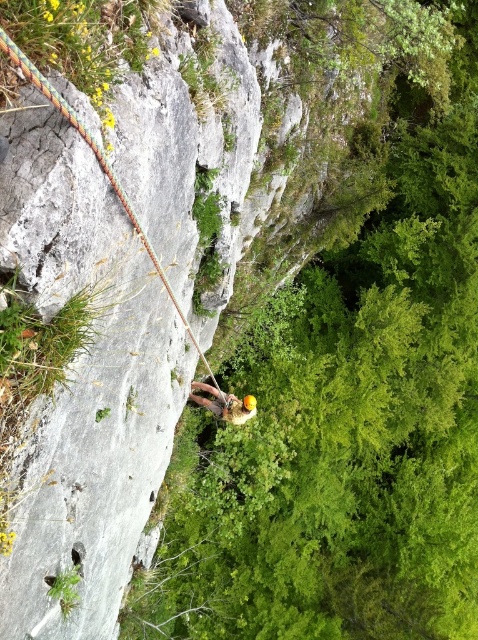
You are a rock climber assessing the safety equipment in the image. The multicolored braided rope at left and the yellow helmet at center are both visible. Which piece of equipment appears larger in the image?

The multicolored braided rope at left appears larger than the yellow helmet at center in the image.

You are a rock climber assessing the gear in the image. The multicolored braided rope at left and the yellow helmet at center are both safety equipment. Which one has a smaller width?

The multicolored braided rope at left has a smaller width than the yellow helmet at center.

You are a rock climber planning to ascend the cliff. You see the multicolored braided rope at left. Based on its position, which direction should you move to reach it?

The multicolored braided rope at left is located at coordinates point 0.209 on the y axis, so you should move downward to reach it.